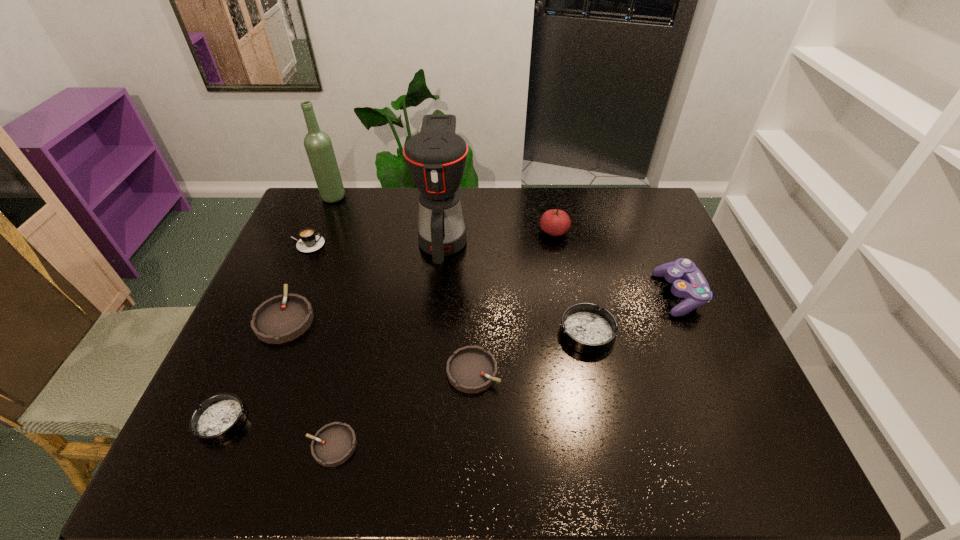
Where is `object that stands as the fourth closest to the right dark ashtray`? object that stands as the fourth closest to the right dark ashtray is located at coordinates (555, 222).

Identify which object is located as the third nearest to the rightmost gray ashtray. Please provide its 2D coordinates. Your answer should be formatted as a tuple, i.e. [(x, y)], where the tuple contains the x and y coordinates of a point satisfying the conditions above.

[(436, 157)]

Find the location of a particular element. Image resolution: width=960 pixels, height=540 pixels. ashtray that stands as the third closest to the cappuccino is located at coordinates (471, 369).

The height and width of the screenshot is (540, 960). I want to click on ashtray that is the closest one to the shortest ashtray, so click(219, 417).

Identify which gray ashtray is the second nearest to the coffee maker. Please provide its 2D coordinates. Your answer should be formatted as a tuple, i.e. [(x, y)], where the tuple contains the x and y coordinates of a point satisfying the conditions above.

[(471, 369)]

Identify which gray ashtray is the nearest to the farthest gray ashtray. Please provide its 2D coordinates. Your answer should be formatted as a tuple, i.e. [(x, y)], where the tuple contains the x and y coordinates of a point satisfying the conditions above.

[(333, 444)]

Find the location of a particular element. free point that satisfies the following two spatial constraints: 1. on the front side of the tomato; 2. on the right side of the farther dark ashtray is located at coordinates (573, 333).

Where is `free region that satisfies the following two spatial constraints: 1. pour from the carafe of the coffee maker; 2. on the left side of the purple control`? The image size is (960, 540). free region that satisfies the following two spatial constraints: 1. pour from the carafe of the coffee maker; 2. on the left side of the purple control is located at coordinates (438, 294).

Locate an element on the screen. The image size is (960, 540). free location that satisfies the following two spatial constraints: 1. with the handle on the side of the cappuccino; 2. on the right side of the rightmost object is located at coordinates (284, 294).